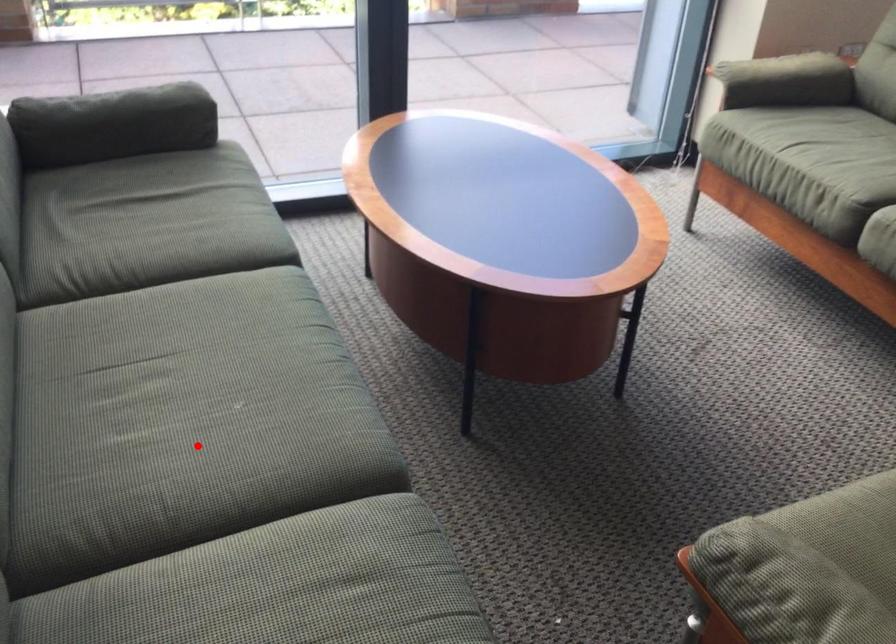
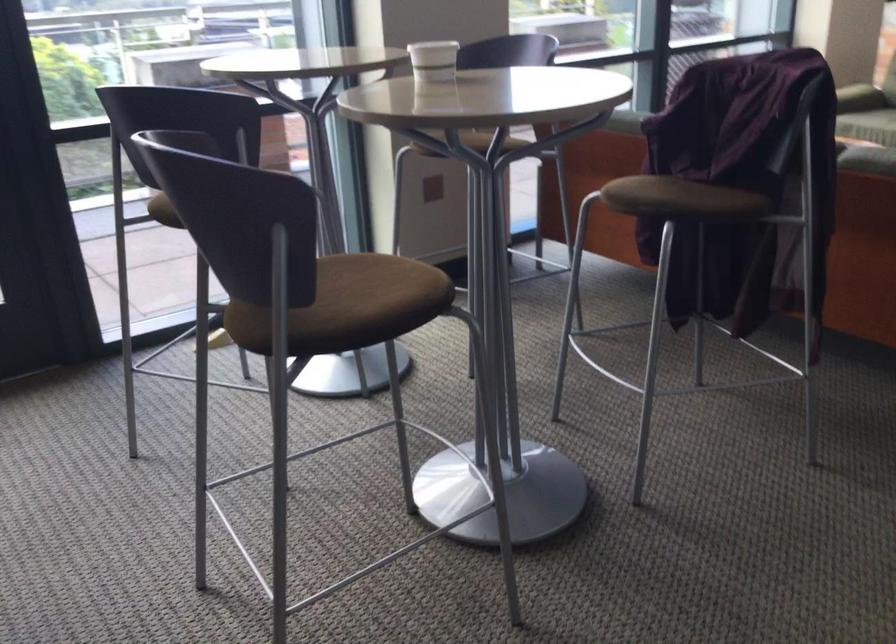
Question: I am providing you with two images of the same scene from different viewpoints. A red point is marked on the first image. At the location where the point appears in image 1, is it still visible in image 2?

Choices:
 (A) Yes
 (B) No

Answer: (B)